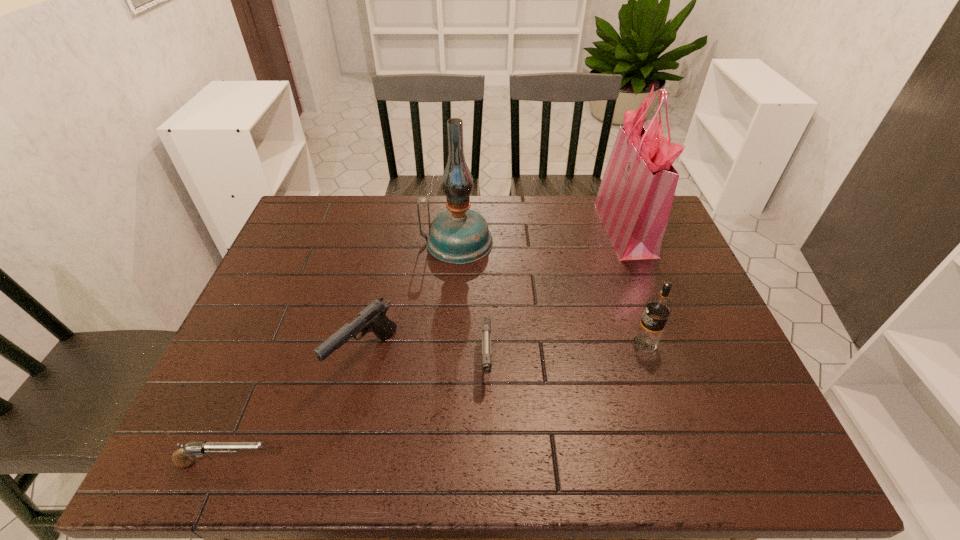
Select which object is the fourth closest to the leftmost object. Please provide its 2D coordinates. Your answer should be formatted as a tuple, i.e. [(x, y)], where the tuple contains the x and y coordinates of a point satisfying the conditions above.

[(658, 308)]

Select which gun is the third closest to the fourth shortest object. Please provide its 2D coordinates. Your answer should be formatted as a tuple, i.e. [(x, y)], where the tuple contains the x and y coordinates of a point satisfying the conditions above.

[(181, 458)]

Find the location of `gun that is the second closest to the leftmost gun`. gun that is the second closest to the leftmost gun is located at coordinates coord(486,321).

Image resolution: width=960 pixels, height=540 pixels. Identify the location of free spot that satisfies the following two spatial constraints: 1. on the front side of the oil lamp; 2. aiming along the barrel of the nearest object. [x=444, y=463].

At what (x,y) coordinates should I click in order to perform the action: click on free point that satisfies the following two spatial constraints: 1. on the front side of the oil lamp; 2. aiming along the barrel of the shortest gun. Please return your answer as a coordinate pair (x, y). This screenshot has height=540, width=960. Looking at the image, I should click on (444, 463).

Identify the location of blank space that satisfies the following two spatial constraints: 1. on the label of the third tallest object; 2. in the direction the rightmost gun is aimed. The height and width of the screenshot is (540, 960). (650, 360).

Find the location of a particular element. The image size is (960, 540). free location that satisfies the following two spatial constraints: 1. in the direction the second tallest gun is aimed; 2. aiming along the barrel of the nearest gun is located at coordinates (488, 463).